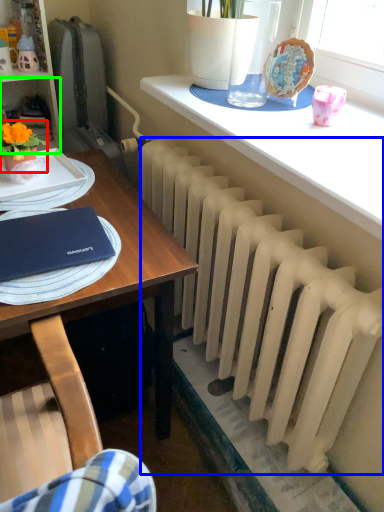
Question: Which object is positioned farthest from houseplant (highlighted by a red box)? Select from radiator (highlighted by a blue box) and shelf (highlighted by a green box).

Choices:
 (A) radiator
 (B) shelf

Answer: (A)